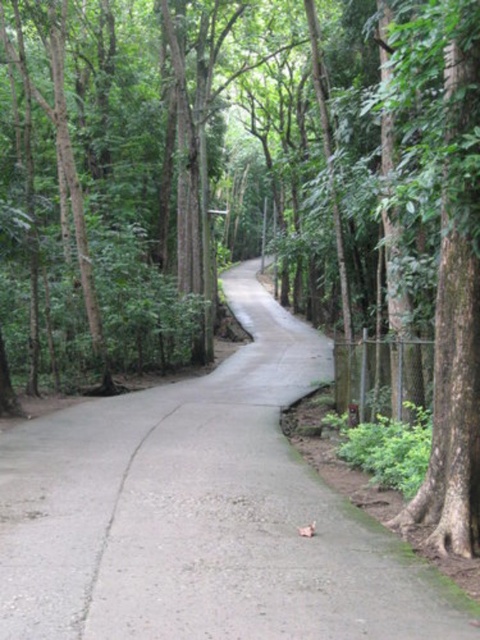
Question: Which point is farther to the camera?

Choices:
 (A) (197, 493)
 (B) (90, 600)

Answer: (A)

Question: Considering the relative positions of gray concrete pavement at center and gray concrete crack at center in the image provided, where is gray concrete pavement at center located with respect to gray concrete crack at center?

Choices:
 (A) left
 (B) right

Answer: (B)

Question: Which object is farther from the camera taking this photo?

Choices:
 (A) gray concrete crack at center
 (B) gray concrete pavement at center

Answer: (B)

Question: Can you confirm if gray concrete pavement at center is positioned above gray concrete crack at center?

Choices:
 (A) yes
 (B) no

Answer: (A)

Question: Does gray concrete pavement at center appear on the left side of gray concrete crack at center?

Choices:
 (A) no
 (B) yes

Answer: (A)